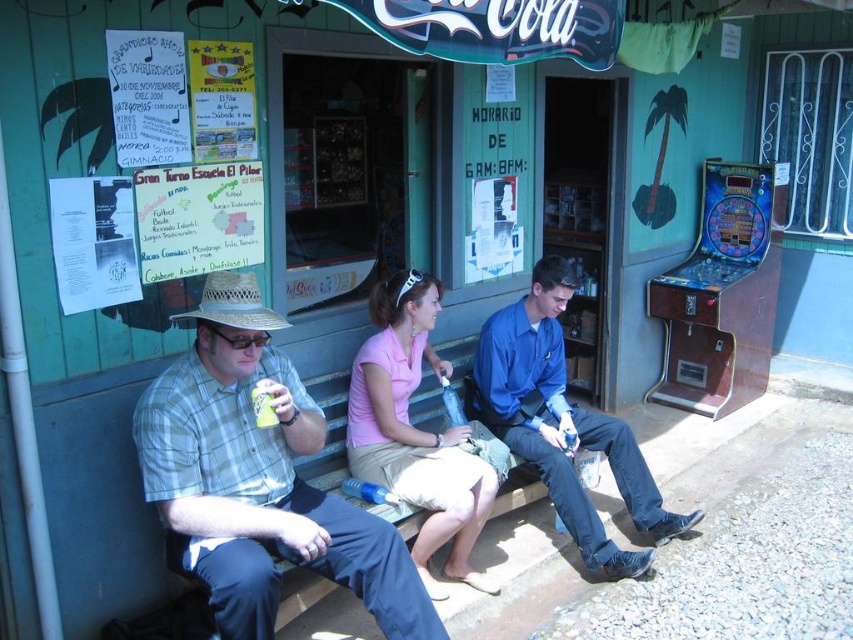
Question: Can you confirm if plaid fabric shirt at left is thinner than green matte can at center?

Choices:
 (A) no
 (B) yes

Answer: (A)

Question: From the image, what is the correct spatial relationship of plaid fabric shirt at left in relation to blue cotton shirt at center?

Choices:
 (A) below
 (B) above

Answer: (A)

Question: Which point is closer to the camera taking this photo?

Choices:
 (A) (776, 246)
 (B) (563, 502)
 (C) (450, 525)
 (D) (210, 481)

Answer: (D)

Question: Can you confirm if plaid fabric shirt at left is wider than blue cotton shirt at center?

Choices:
 (A) no
 (B) yes

Answer: (A)

Question: Among these points, which one is farthest from the camera?

Choices:
 (A) (471, 538)
 (B) (770, 228)

Answer: (B)

Question: Which point is farther to the camera?

Choices:
 (A) (694, 250)
 (B) (511, 444)
 (C) (265, 397)
 (D) (140, 470)

Answer: (A)